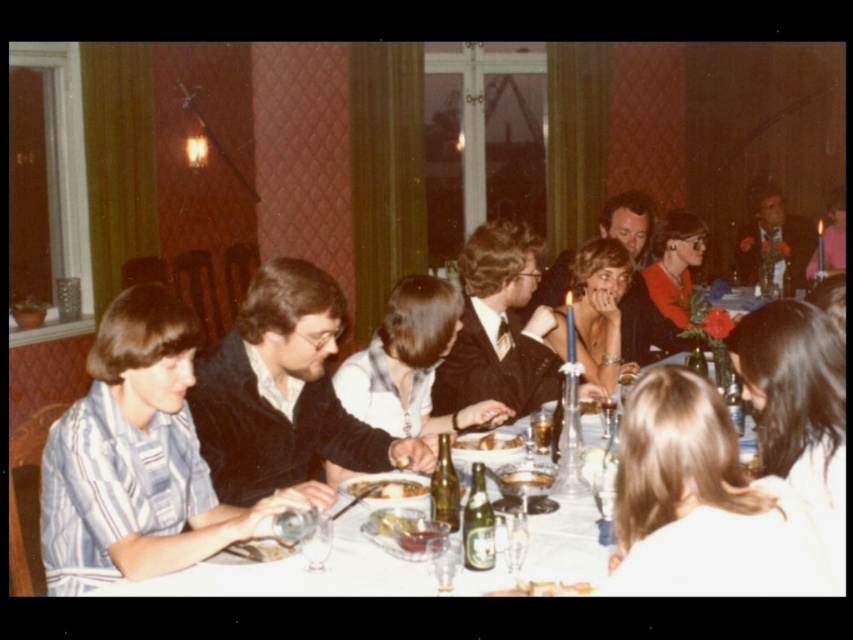
Between point (813, 248) and point (242, 557), which one is positioned in front?

Point (242, 557) is in front.

Is matte black candle at upper right shorter than smooth brown bread at table center?

No.

This screenshot has height=640, width=853. I want to click on matte black candle at upper right, so click(830, 240).

Who is lower down, white creamy pasta at center or shiny silver plate at center?

white creamy pasta at center

Where is `white creamy pasta at center`? This screenshot has width=853, height=640. white creamy pasta at center is located at coordinates (386, 488).

Where is `white creamy pasta at center`? white creamy pasta at center is located at coordinates (386, 488).

Which is behind, point (267, 486) or point (514, 300)?

The point (514, 300) is behind.

Which is more to the right, velvet black sweater at center or matte black suit at center?

Positioned to the right is matte black suit at center.

Locate an element on the screen. velvet black sweater at center is located at coordinates (283, 392).

Where is `velvet black sweater at center`? The width and height of the screenshot is (853, 640). velvet black sweater at center is located at coordinates (283, 392).